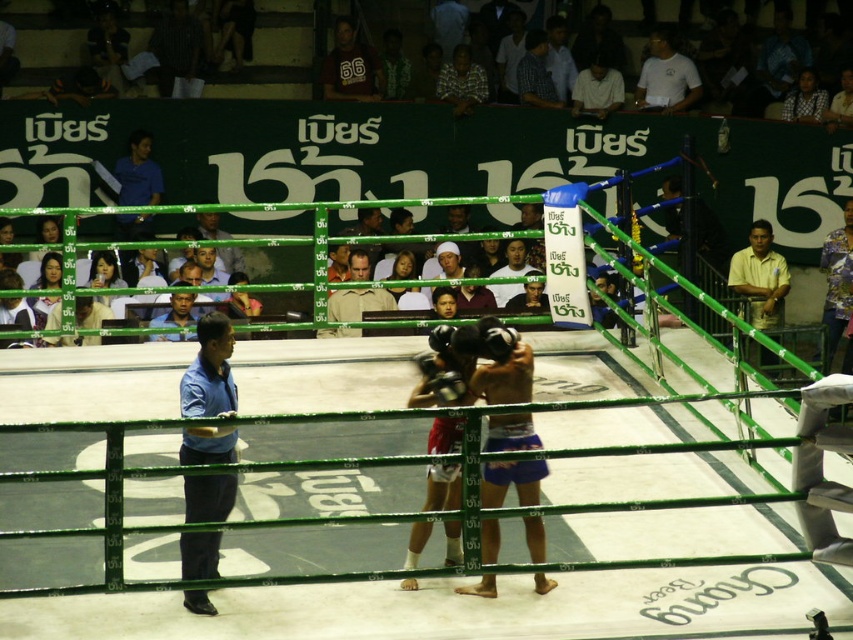
You are a photographer positioned outside the ring. You want to capture a photo that includes both the yellow matte shirt at right and the light brown leather jacket at upper center. Which object should you adjust your camera angle to focus on first to ensure both are in frame?

The yellow matte shirt at right is wider than the light brown leather jacket at upper center, so you should focus on the yellow matte shirt at right first to ensure both objects are fully captured in the frame.

You are a photographer positioned at the edge of the Muay Thai ring. You want to take a photo of the checkered fabric shirt at upper center and the light brown wooden chair at upper center. However, you can only focus on one object at a time. Which object should you focus on first to ensure it is in the foreground of the photo?

You should focus on the checkered fabric shirt at upper center first because the light brown wooden chair at upper center is behind it, so the shirt will be in the foreground.